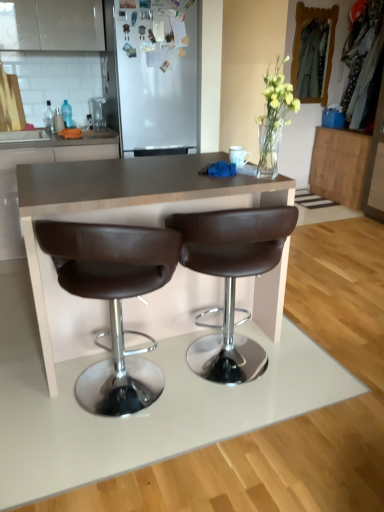
Identify the location of free space in front of brown leather stool at center, positioned as the first chair in left-to-right order. (115, 465).